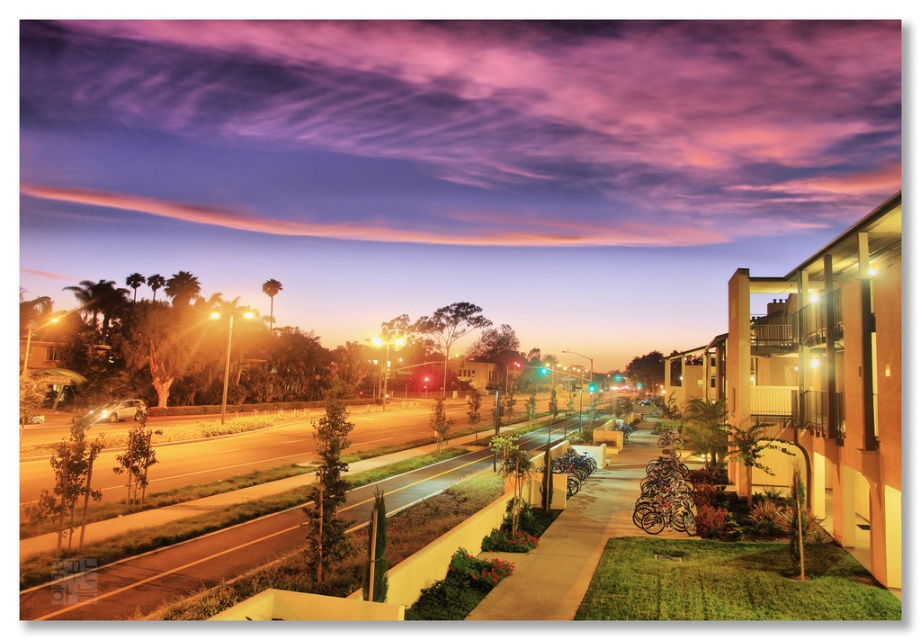
Question: Which is nearer to the concrete sidewalk at center?

Choices:
 (A) smooth asphalt road at center
 (B) purple cloud at upper center

Answer: (A)

Question: Does purple cloud at upper center appear under smooth asphalt road at center?

Choices:
 (A) yes
 (B) no

Answer: (B)

Question: Can you confirm if purple cloud at upper center is positioned to the left of concrete sidewalk at center?

Choices:
 (A) yes
 (B) no

Answer: (A)

Question: Estimate the real-world distances between objects in this image. Which object is farther from the smooth asphalt road at center?

Choices:
 (A) concrete sidewalk at center
 (B) purple cloud at upper center

Answer: (B)

Question: Which object is farther from the camera taking this photo?

Choices:
 (A) concrete sidewalk at center
 (B) purple cloud at upper center

Answer: (B)

Question: Does purple cloud at upper center lie behind smooth asphalt road at center?

Choices:
 (A) no
 (B) yes

Answer: (B)